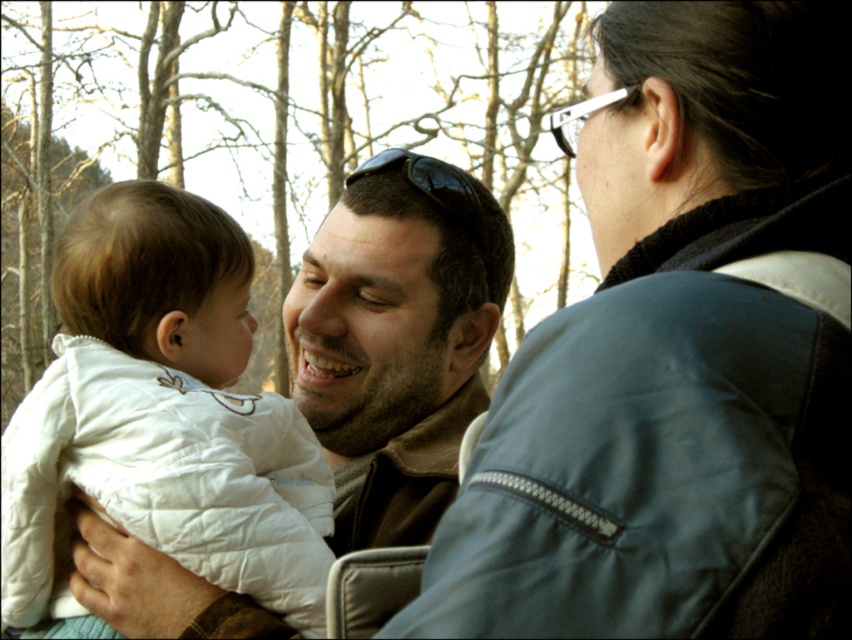
Question: Is white quilted jacket at left in front of black matte sunglasses at center?

Choices:
 (A) no
 (B) yes

Answer: (B)

Question: Does blue leather jacket at center appear over black matte sunglasses at center?

Choices:
 (A) no
 (B) yes

Answer: (A)

Question: Which object is closer to the camera taking this photo?

Choices:
 (A) black matte sunglasses at center
 (B) white quilted jacket at left
 (C) blue leather jacket at center

Answer: (C)

Question: Which of the following is the closest to the observer?

Choices:
 (A) blue leather jacket at center
 (B) white quilted jacket at left
 (C) black matte sunglasses at center

Answer: (A)

Question: Which object appears closest to the camera in this image?

Choices:
 (A) blue leather jacket at center
 (B) black matte sunglasses at center
 (C) white quilted jacket at left

Answer: (A)

Question: Is blue leather jacket at center positioned behind white quilted jacket at left?

Choices:
 (A) yes
 (B) no

Answer: (B)